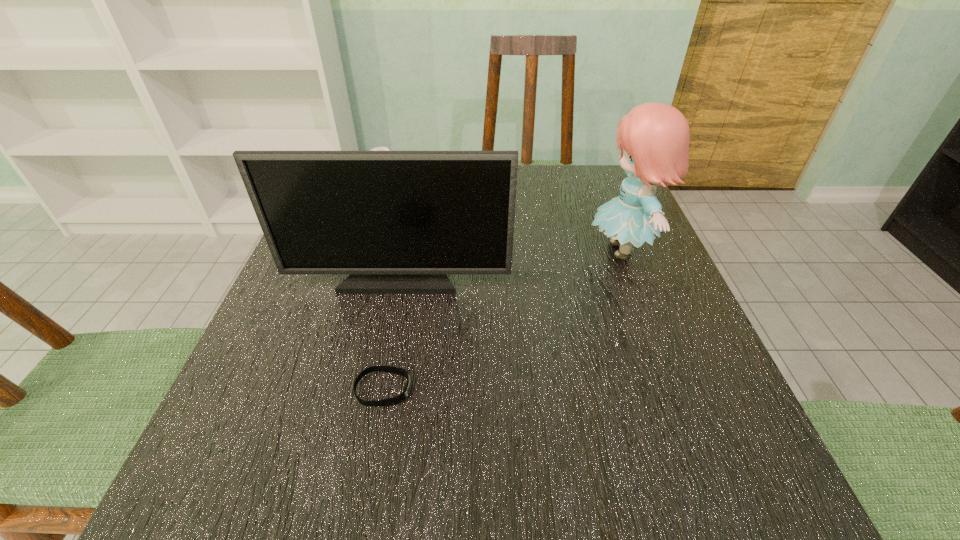
At what (x,y) coordinates should I click in order to perform the action: click on free space at the left edge of the desktop. Please return your answer as a coordinate pair (x, y). Looking at the image, I should click on (305, 292).

Locate an element on the screen. This screenshot has width=960, height=540. free space at the right edge is located at coordinates (645, 305).

Where is `vacant space at the far right corner`? The height and width of the screenshot is (540, 960). vacant space at the far right corner is located at coordinates (609, 199).

In the image, there is a desktop. Identify the location of free region at the near right corner. The image size is (960, 540). click(714, 490).

The width and height of the screenshot is (960, 540). I want to click on free space between the rightmost object and the nearest object, so click(x=503, y=319).

Point out which object is positioned as the nearest to the monitor. Please provide its 2D coordinates. Your answer should be formatted as a tuple, i.e. [(x, y)], where the tuple contains the x and y coordinates of a point satisfying the conditions above.

[(653, 138)]

Select which object appears as the third closest to the monitor. Please provide its 2D coordinates. Your answer should be formatted as a tuple, i.e. [(x, y)], where the tuple contains the x and y coordinates of a point satisfying the conditions above.

[(376, 148)]